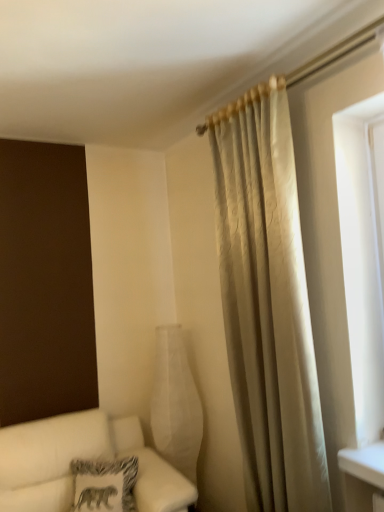
Question: From the image's perspective, would you say white fabric couch at lower left is positioned over patterned fabric pillow at lower left?

Choices:
 (A) no
 (B) yes

Answer: (A)

Question: Considering the relative positions of white fabric couch at lower left and patterned fabric pillow at lower left in the image provided, is white fabric couch at lower left to the left of patterned fabric pillow at lower left from the viewer's perspective?

Choices:
 (A) no
 (B) yes

Answer: (A)

Question: Is patterned fabric pillow at lower left located within white fabric couch at lower left?

Choices:
 (A) yes
 (B) no

Answer: (A)

Question: From a real-world perspective, is white fabric couch at lower left located beneath patterned fabric pillow at lower left?

Choices:
 (A) yes
 (B) no

Answer: (A)

Question: Is patterned fabric pillow at lower left at the back of white fabric couch at lower left?

Choices:
 (A) no
 (B) yes

Answer: (B)

Question: Is white matte glass vase at center situated inside silky beige curtain at right or outside?

Choices:
 (A) inside
 (B) outside

Answer: (B)

Question: From the image's perspective, is white matte glass vase at center positioned above or below silky beige curtain at right?

Choices:
 (A) above
 (B) below

Answer: (B)

Question: In the image, is white matte glass vase at center positioned in front of or behind silky beige curtain at right?

Choices:
 (A) behind
 (B) front

Answer: (A)

Question: Considering the positions of point (188, 386) and point (299, 426), is point (188, 386) closer or farther from the camera than point (299, 426)?

Choices:
 (A) farther
 (B) closer

Answer: (A)

Question: Based on their sizes in the image, would you say patterned fabric pillow at lower left is bigger or smaller than silky beige curtain at right?

Choices:
 (A) small
 (B) big

Answer: (A)

Question: From their relative heights in the image, would you say patterned fabric pillow at lower left is taller or shorter than silky beige curtain at right?

Choices:
 (A) short
 (B) tall

Answer: (A)

Question: Is patterned fabric pillow at lower left to the left or to the right of silky beige curtain at right in the image?

Choices:
 (A) right
 (B) left

Answer: (B)

Question: Is point (97, 471) positioned closer to the camera than point (220, 134)?

Choices:
 (A) farther
 (B) closer

Answer: (A)

Question: From a real-world perspective, is white matte glass vase at center physically located above or below white fabric couch at lower left?

Choices:
 (A) below
 (B) above

Answer: (B)

Question: Does point (187, 375) appear closer or farther from the camera than point (155, 481)?

Choices:
 (A) farther
 (B) closer

Answer: (A)